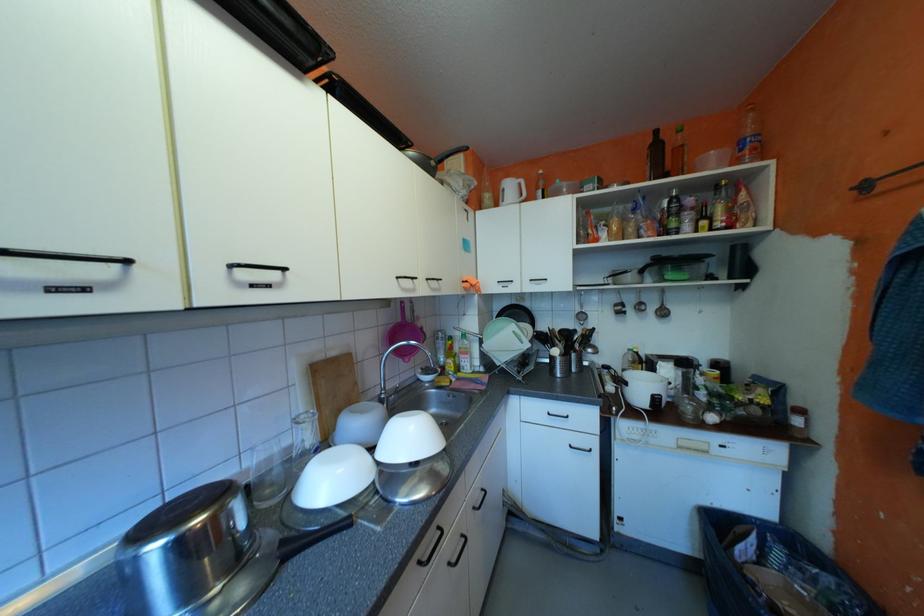
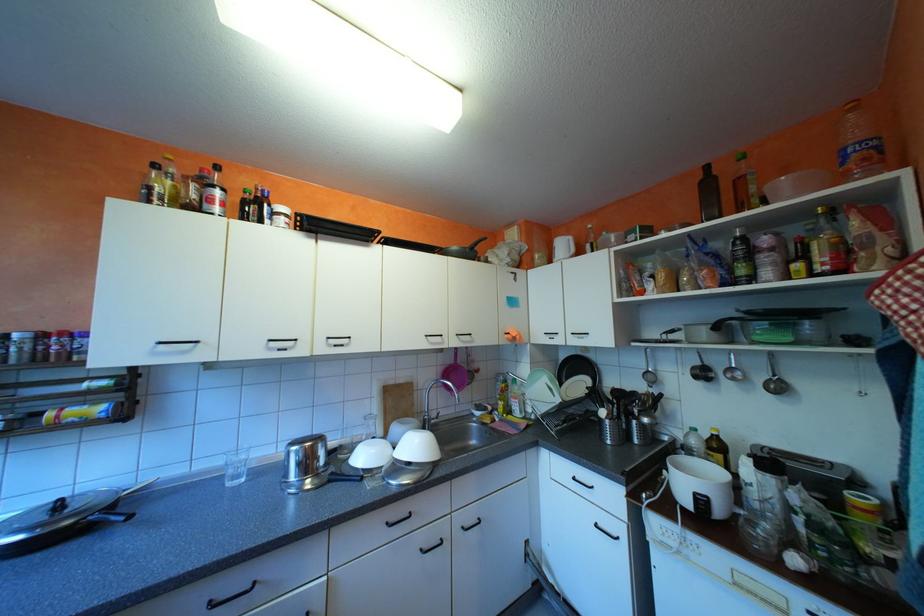
In the second image, find the point that corresponds to point (431, 562) in the first image.

(398, 523)